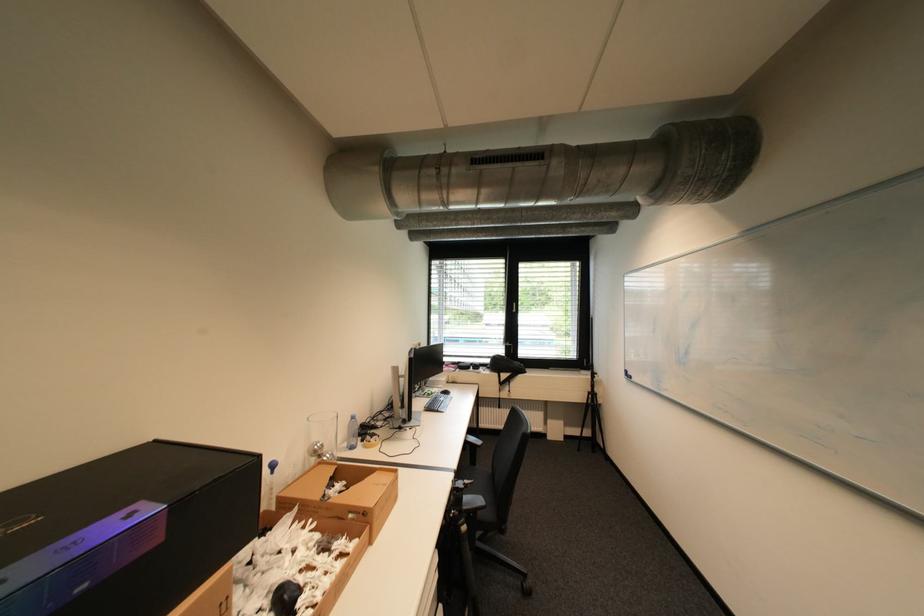
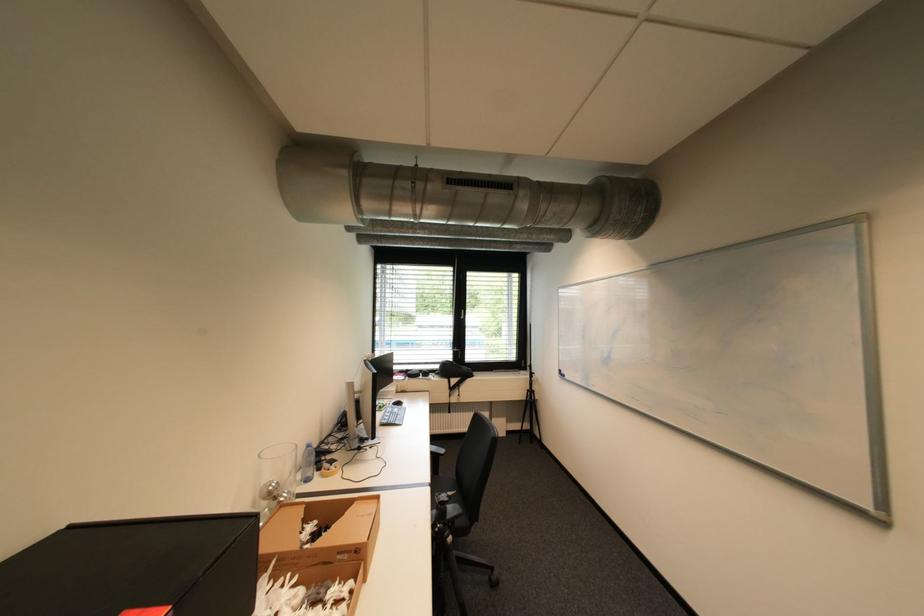
The point at (x=268, y=456) is marked in the first image. Where is the corresponding point in the second image?

(265, 516)